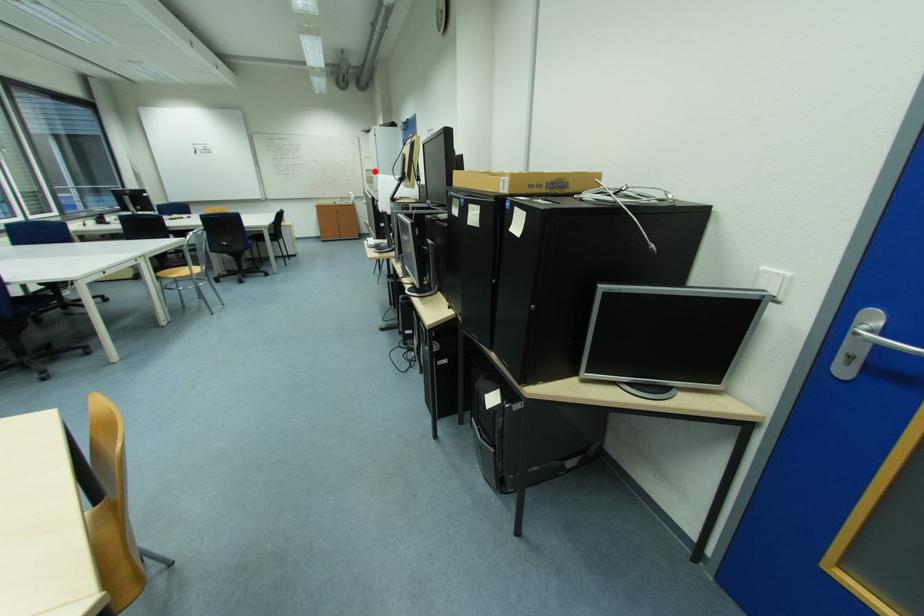
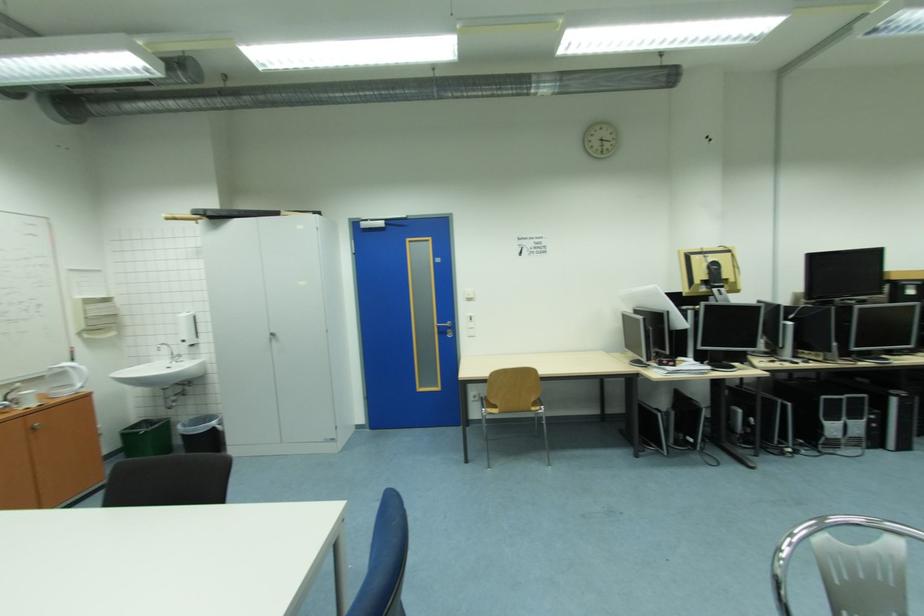
Locate, in the second image, the point that corresponds to the highlighted location in the first image.

(94, 302)